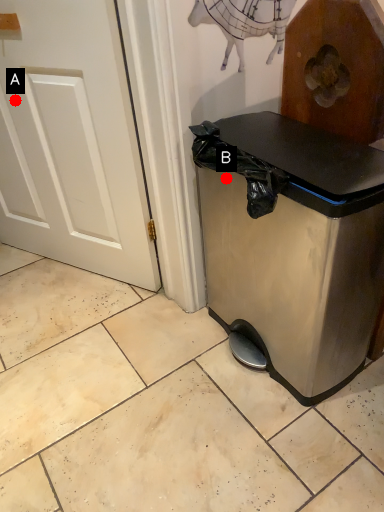
Question: Two points are circled on the image, labeled by A and B beside each circle. Which of the following is the closest to the observer?

Choices:
 (A) A is closer
 (B) B is closer

Answer: (A)